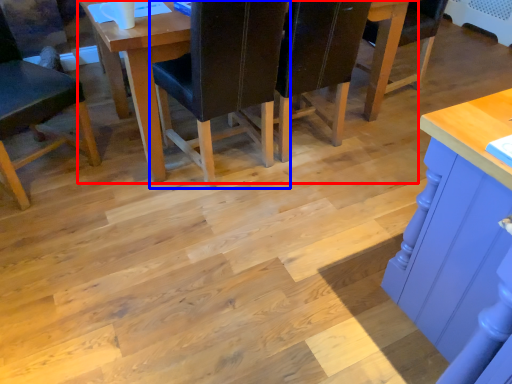
Question: Which of the following is the farthest to the observer, table (highlighted by a red box) or chair (highlighted by a blue box)?

Choices:
 (A) table
 (B) chair

Answer: (A)